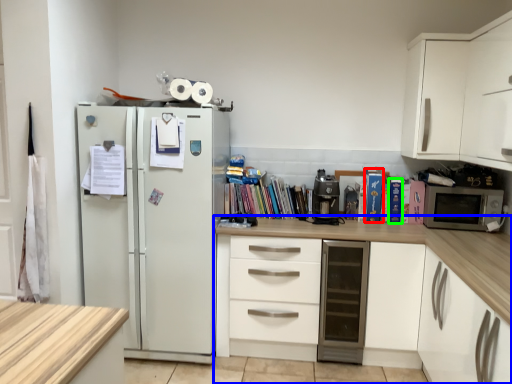
Question: Based on their relative distances, which object is nearer to paperback book (highlighted by a red box)? Choose from cabinetry (highlighted by a blue box) and paperback book (highlighted by a green box).

Choices:
 (A) cabinetry
 (B) paperback book

Answer: (B)